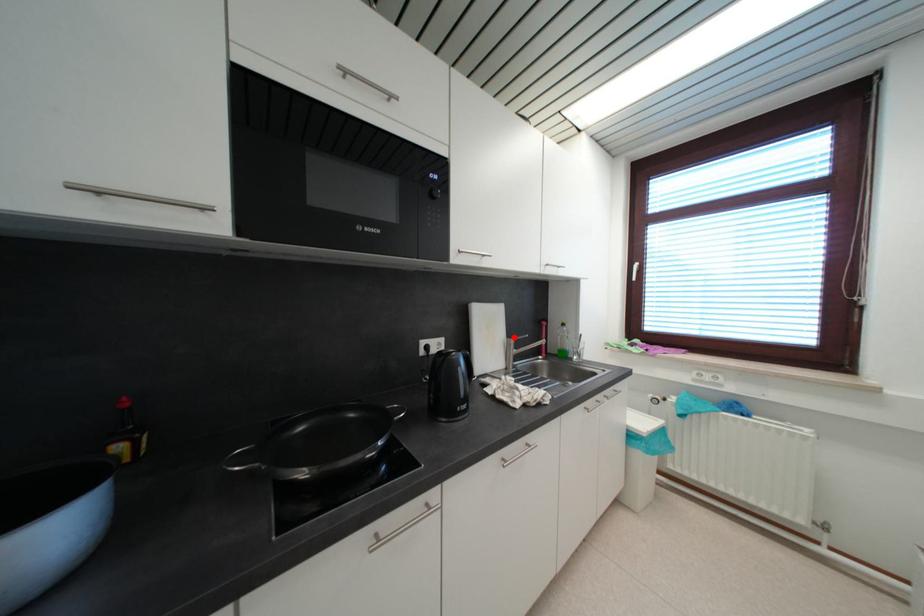
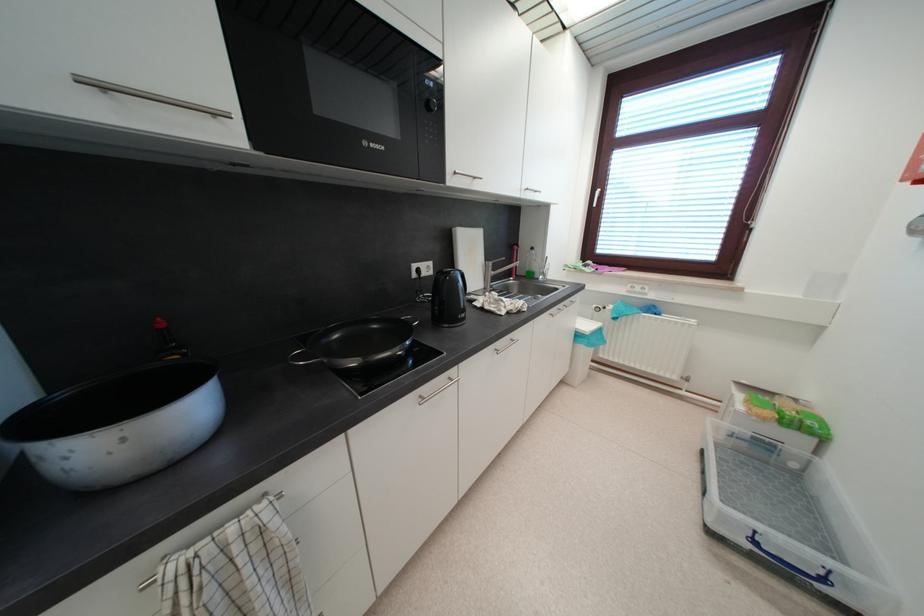
In the second image, find the point that corresponds to the highlighted location in the first image.

(492, 261)